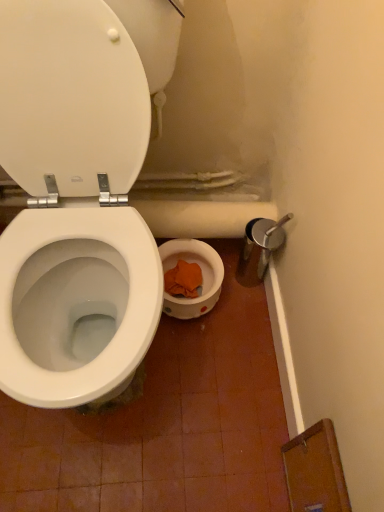
Question: Is white glossy toilet at center bigger or smaller than white glossy toilet lid at upper left?

Choices:
 (A) big
 (B) small

Answer: (A)

Question: Considering their positions, is white glossy toilet at center located in front of or behind white glossy toilet lid at upper left?

Choices:
 (A) behind
 (B) front

Answer: (B)

Question: From the image's perspective, is white glossy toilet at center above or below white glossy toilet lid at upper left?

Choices:
 (A) above
 (B) below

Answer: (B)

Question: Visually, is white glossy toilet lid at upper left positioned to the left or to the right of white glossy toilet at center?

Choices:
 (A) left
 (B) right

Answer: (B)

Question: From the image's perspective, is white glossy toilet lid at upper left located above or below white glossy toilet at center?

Choices:
 (A) below
 (B) above

Answer: (B)

Question: Considering the positions of white glossy toilet lid at upper left and white glossy toilet at center in the image, is white glossy toilet lid at upper left wider or thinner than white glossy toilet at center?

Choices:
 (A) thin
 (B) wide

Answer: (A)

Question: From a real-world perspective, is white glossy toilet lid at upper left physically located above or below white glossy toilet at center?

Choices:
 (A) above
 (B) below

Answer: (B)